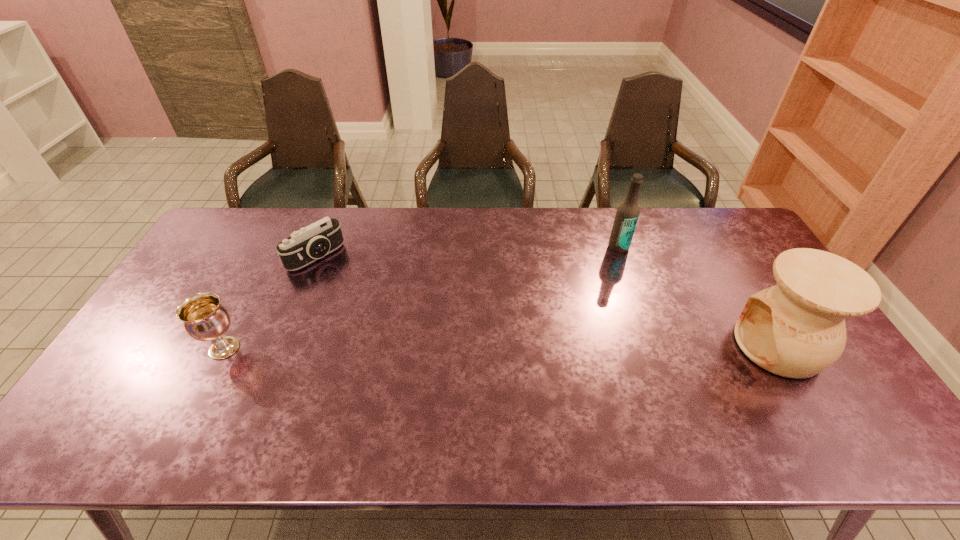
Find the location of a particular element. object that is at the near right corner is located at coordinates (796, 329).

In the image, there is a desktop. In order to click on vacant space at the far edge in this screenshot , I will do `click(670, 241)`.

Locate an element on the screen. vacant space at the near edge of the desktop is located at coordinates (774, 404).

Identify the location of vacant point at the left edge. Image resolution: width=960 pixels, height=540 pixels. (151, 353).

This screenshot has height=540, width=960. I want to click on vacant point at the right edge, so click(x=751, y=255).

The height and width of the screenshot is (540, 960). Identify the location of vacant space at the far right corner of the desktop. (742, 226).

Locate an element on the screen. free space between the leftmost object and the beer bottle is located at coordinates (421, 298).

Find the location of `vacant area that lies between the chalice and the beer bottle`. vacant area that lies between the chalice and the beer bottle is located at coordinates (421, 298).

Find the location of a particular element. Image resolution: width=960 pixels, height=540 pixels. empty location between the leftmost object and the third object from right to left is located at coordinates (271, 302).

Find the location of a particular element. The width and height of the screenshot is (960, 540). free space between the shortest object and the rightmost object is located at coordinates (547, 301).